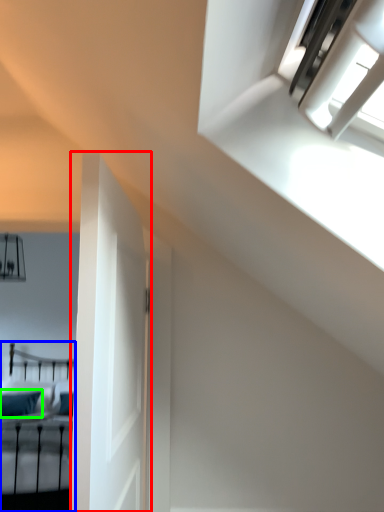
Question: Estimate the real-world distances between objects in this image. Which object is closer to door (highlighted by a red box), bed (highlighted by a blue box) or pillow (highlighted by a green box)?

Choices:
 (A) bed
 (B) pillow

Answer: (A)